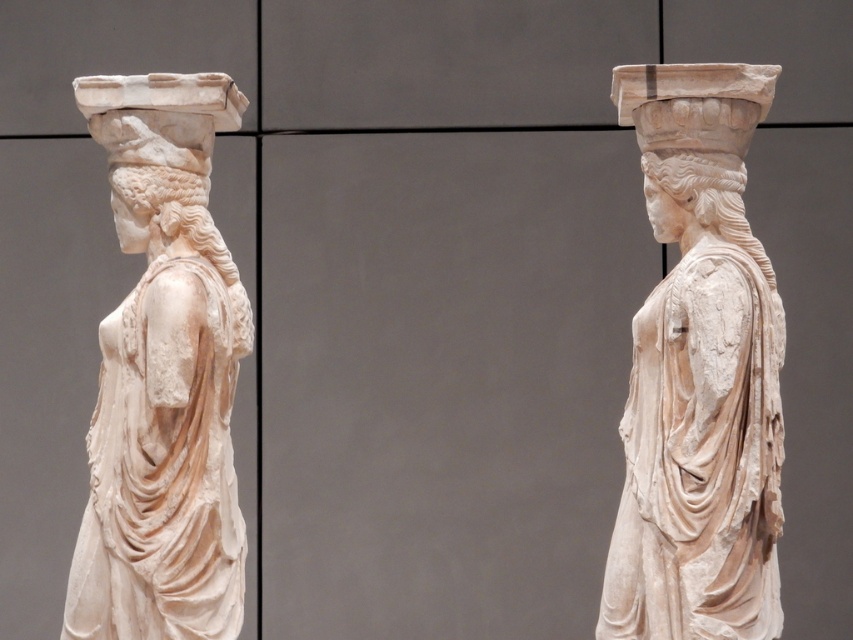
How far apart are white marble statue at center and white marble statue at left?

white marble statue at center is 29.63 inches from white marble statue at left.

Which is more to the right, white marble statue at center or white marble statue at left?

white marble statue at center is more to the right.

Is point (708, 369) behind point (79, 625)?

No, (708, 369) is in front of (79, 625).

At what (x,y) coordinates should I click in order to perform the action: click on white marble statue at center. Please return your answer as a coordinate pair (x, y). This screenshot has height=640, width=853. Looking at the image, I should click on pyautogui.click(x=699, y=372).

Can you confirm if white marble head at center is smaller than white marble head at upper left?

No, white marble head at center is not smaller than white marble head at upper left.

Does point (718, 184) lie in front of point (184, 179)?

Yes, point (718, 184) is in front of point (184, 179).

You are a GUI agent. You are given a task and a screenshot of the screen. Output one action in this format:
    pyautogui.click(x=<x>, y=<y>)
    Task: Click on the white marble head at center
    Image resolution: width=853 pixels, height=640 pixels.
    Given the screenshot: What is the action you would take?
    pyautogui.click(x=701, y=188)

Does white marble statue at center have a greater height compared to white marble head at center?

Indeed, white marble statue at center has a greater height compared to white marble head at center.

Between white marble statue at center and white marble head at center, which one is positioned lower?

white marble statue at center is lower down.

Which is behind, point (753, 246) or point (643, 157)?

The point (643, 157) is more distant.

The image size is (853, 640). I want to click on white marble statue at center, so click(x=699, y=372).